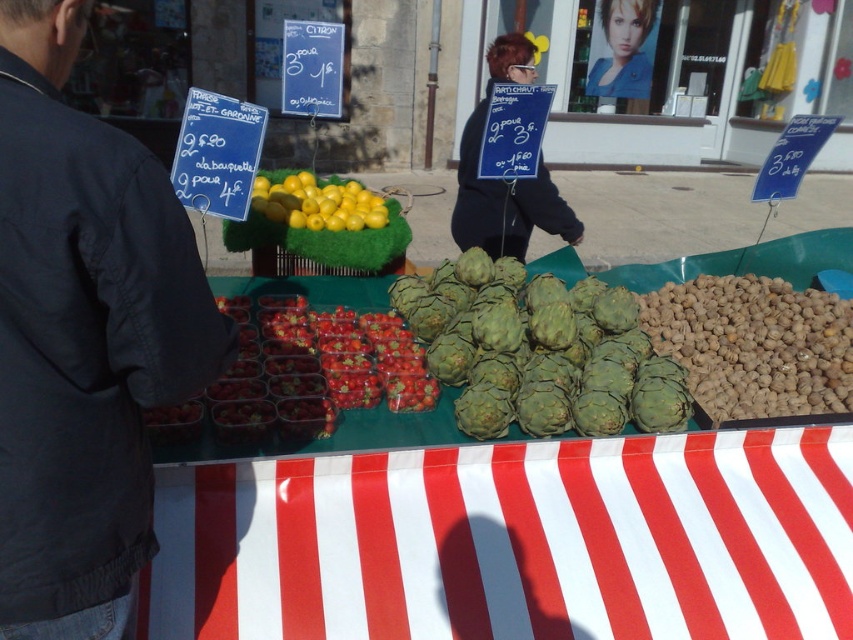
Question: Does dark blue jacket at left appear on the right side of brown rough walnut at right?

Choices:
 (A) no
 (B) yes

Answer: (A)

Question: Among these points, which one is farthest from the camera?

Choices:
 (A) (91, 595)
 (B) (590, 92)

Answer: (B)

Question: Is dark blue jacket at left thinner than yellow smooth lemons at center?

Choices:
 (A) yes
 (B) no

Answer: (A)

Question: Is brown rough walnut at right below dark blue fabric sign at center?

Choices:
 (A) yes
 (B) no

Answer: (A)

Question: Which object is closer to the camera taking this photo?

Choices:
 (A) smooth blonde hair at upper center
 (B) brown rough walnut at right

Answer: (B)

Question: Which point appears farthest from the camera in this image?

Choices:
 (A) (764, 294)
 (B) (277, 186)
 (C) (15, 216)
 (D) (538, 211)

Answer: (D)